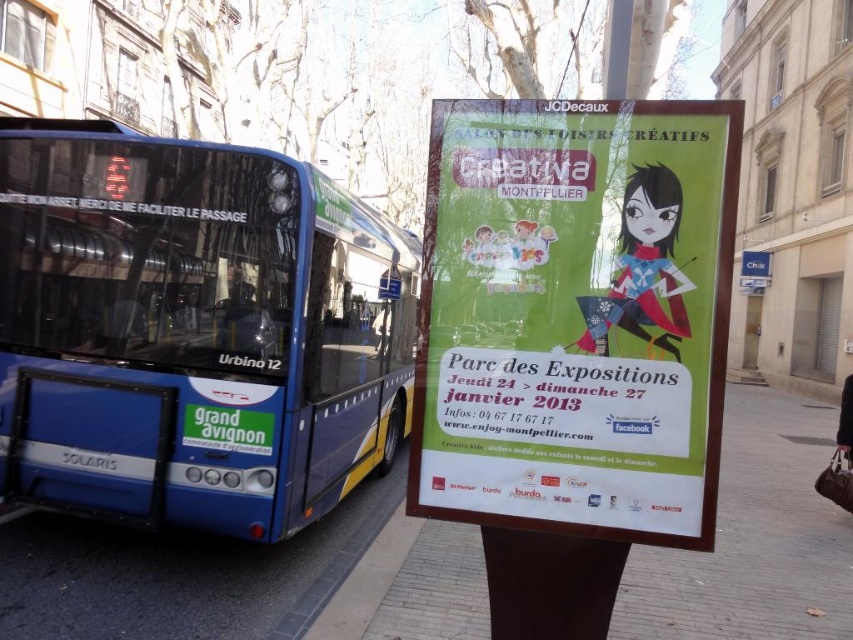
Question: Can you confirm if blue metallic bus at left is positioned to the right of green paper poster at right?

Choices:
 (A) no
 (B) yes

Answer: (A)

Question: Which point is farther from the camera taking this photo?

Choices:
 (A) (728, 298)
 (B) (683, 566)

Answer: (B)

Question: Among these points, which one is nearest to the camera?

Choices:
 (A) (767, 470)
 (B) (633, 472)

Answer: (B)

Question: Is blue metallic bus at left behind green paper poster at right?

Choices:
 (A) yes
 (B) no

Answer: (A)

Question: Observing the image, what is the correct spatial positioning of green paper poster at right in reference to smooth concrete pavement at center?

Choices:
 (A) right
 (B) left

Answer: (B)

Question: Which of the following is the farthest from the observer?

Choices:
 (A) (695, 564)
 (B) (532, 440)

Answer: (A)